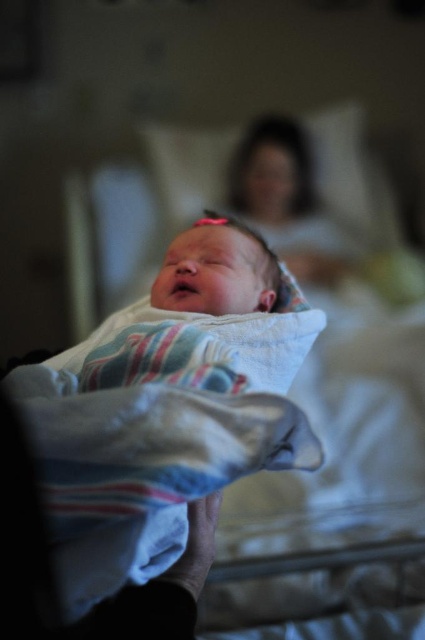
In the scene shown: Is smooth skin mother at upper center taller than white soft blanket at center?

Indeed, smooth skin mother at upper center has a greater height compared to white soft blanket at center.

Identify the location of smooth skin mother at upper center. (286, 200).

Between point (300, 227) and point (229, 236), which one is positioned behind?

The point (300, 227) is behind.

Identify the location of smooth skin mother at upper center. This screenshot has width=425, height=640. (x=286, y=200).